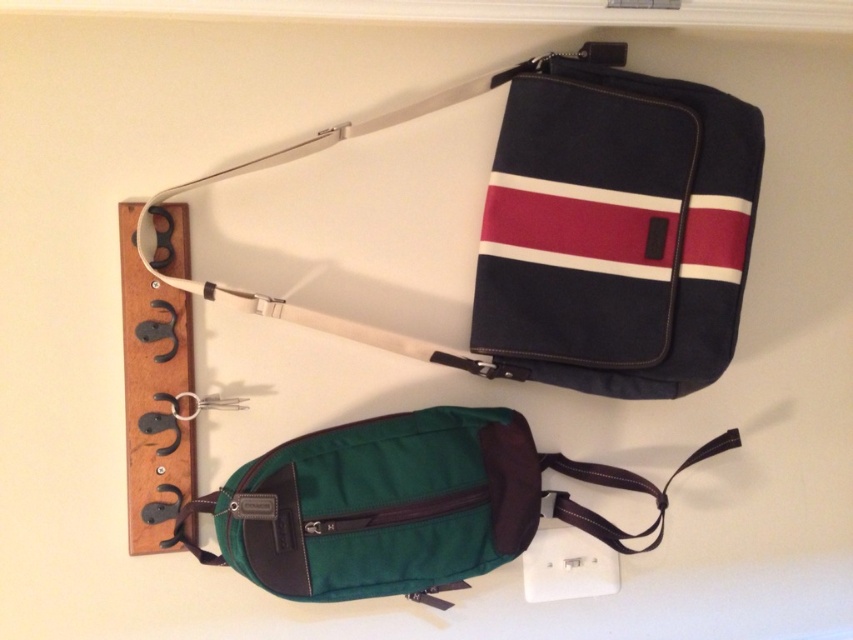
Does navy canvas shoulder bag at upper right appear on the right side of green fabric pouch at lower center?

In fact, navy canvas shoulder bag at upper right is to the left of green fabric pouch at lower center.

Who is more forward, (602, 170) or (409, 420)?

Point (409, 420) is more forward.

You are a GUI agent. You are given a task and a screenshot of the screen. Output one action in this format:
    pyautogui.click(x=<x>, y=<y>)
    Task: Click on the navy canvas shoulder bag at upper right
    The height and width of the screenshot is (640, 853).
    Given the screenshot: What is the action you would take?
    pyautogui.click(x=587, y=227)

Find the location of a particular element. The height and width of the screenshot is (640, 853). navy canvas shoulder bag at upper right is located at coordinates (587, 227).